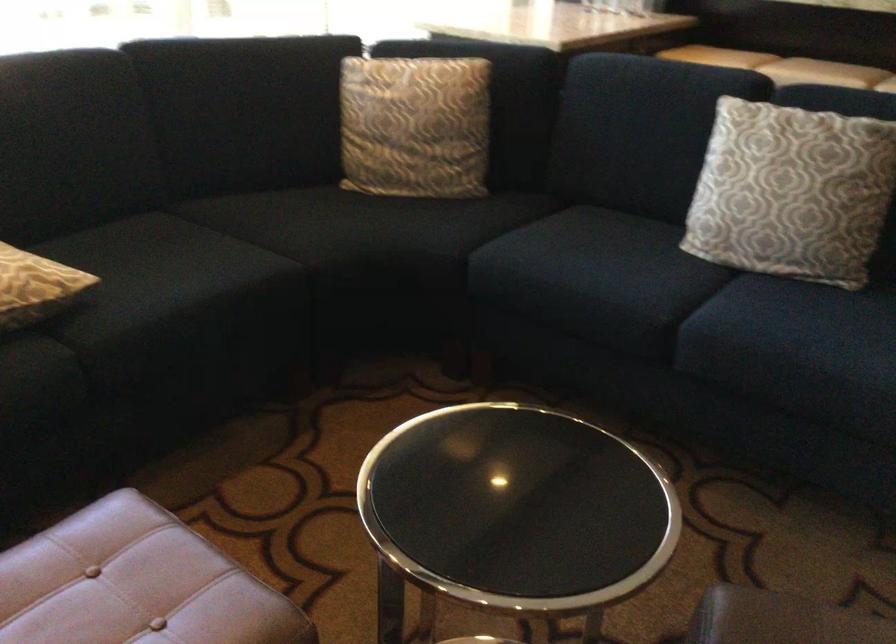
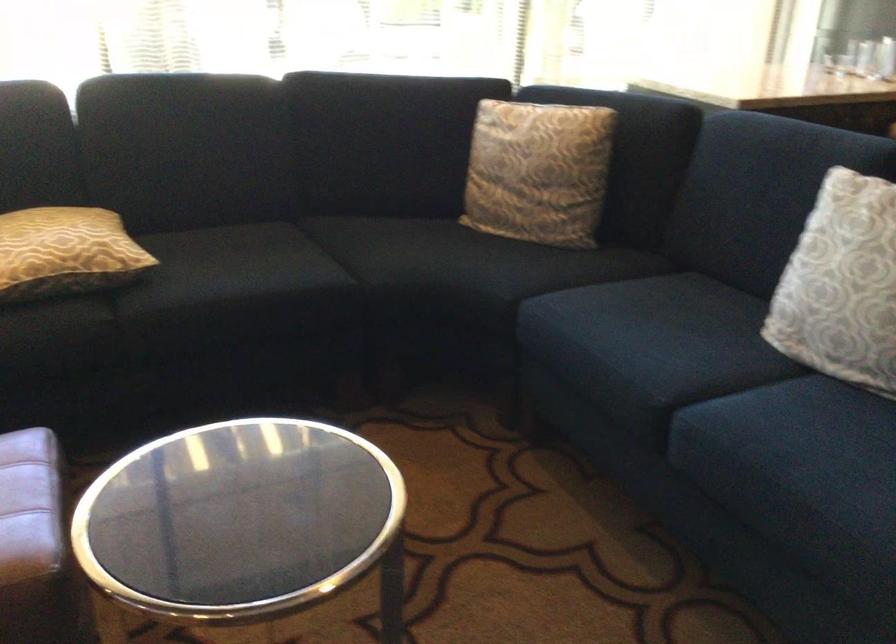
Question: Which direction would the cameraman need to move to produce the second image? Reply with the corresponding letter.

Choices:
 (A) Left
 (B) Right
 (C) Forward
 (D) Backward

Answer: (B)